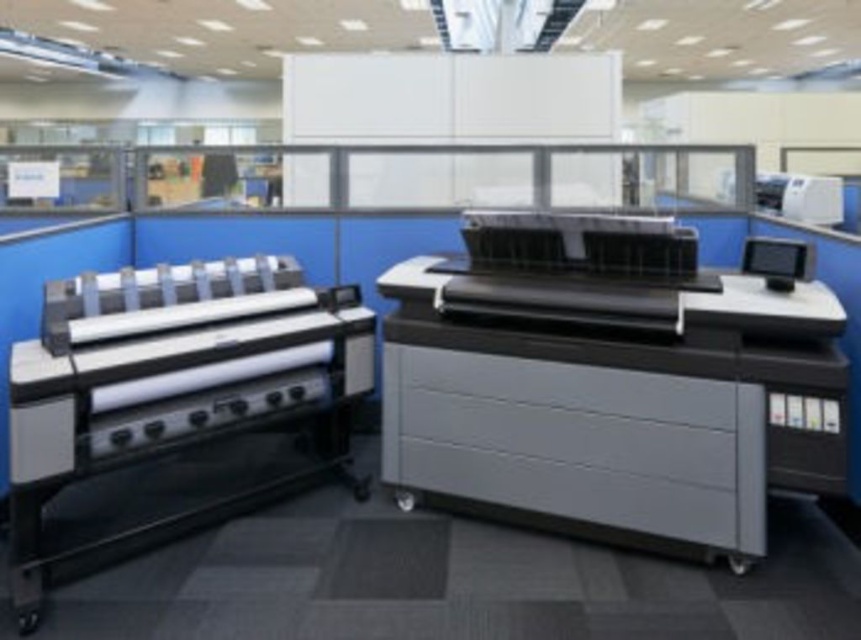
You are an office worker who needs to locate the matte black printer at center in your workspace. Based on the scene description, can you confirm if the point you are standing at, which is at coordinates point (614, 401), is the correct location for the matte black printer at center?

Yes, the point (614, 401) is the correct location for the matte black printer at center as stated in the Objects Description.

You are an office worker who needs to move a heavy box from the entrance to the storage room. The path requires passing between the matte black printer at center and the black glossy monitor at upper right. Can you navigate through this space without hitting either object?

The matte black printer at center is to the left of the black glossy monitor at upper right, so there is space between them to navigate through. However, the exact width of the path isn